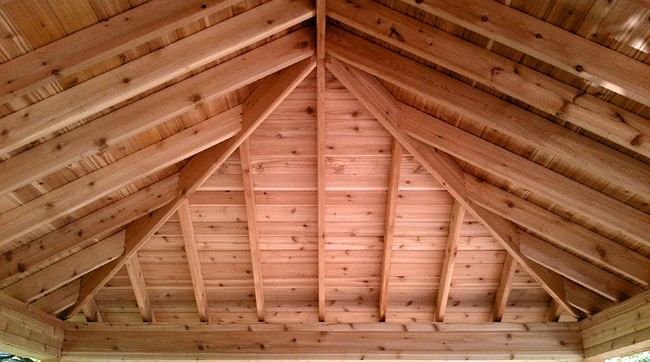
Identify the location of beams at bottom of ceiling. (32, 325), (370, 344), (627, 337).